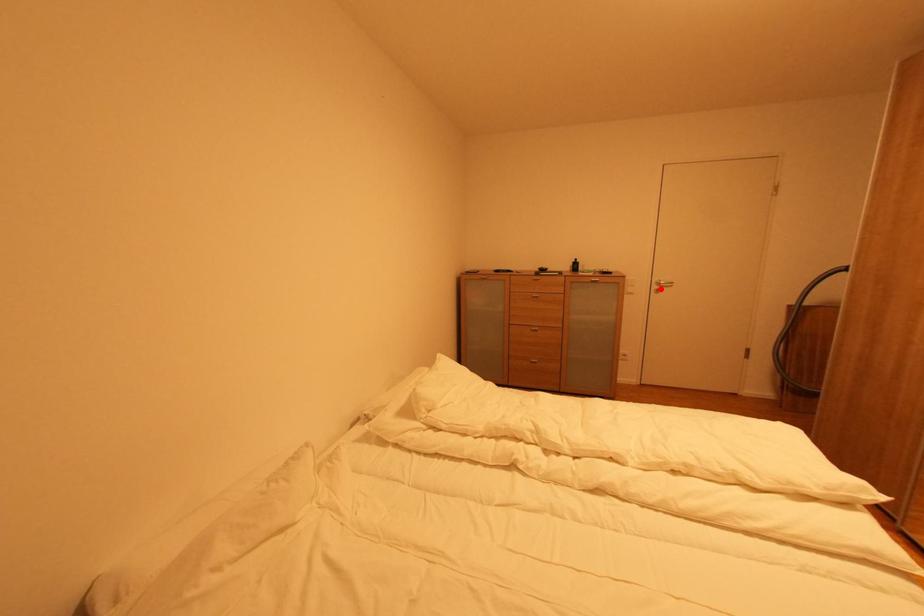
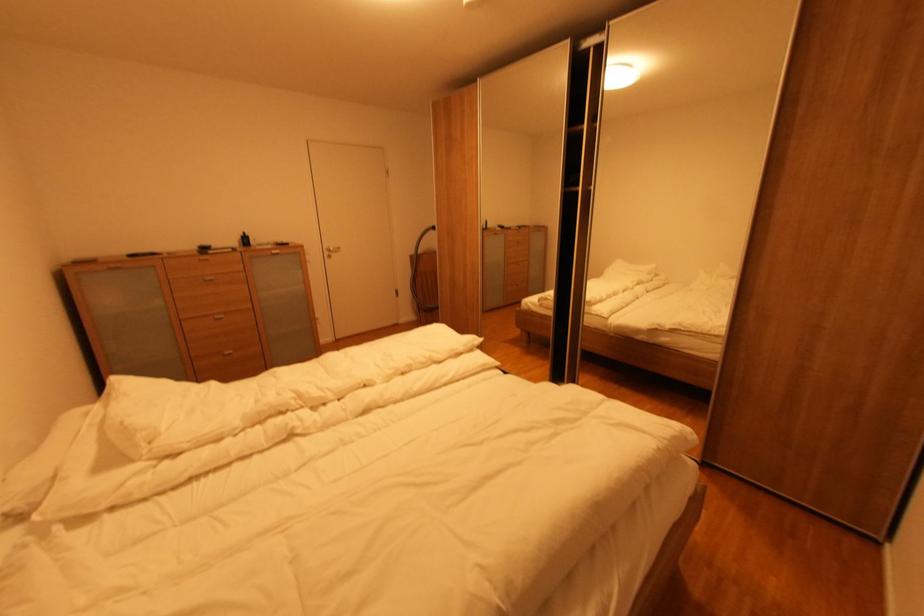
Where in the second image is the point corresponding to the highlighted location from the first image?

(333, 254)